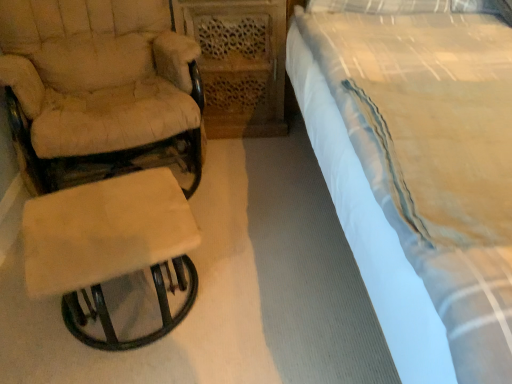
Question: Is beige fabric chair at left behind white cotton bed at right?

Choices:
 (A) yes
 (B) no

Answer: (A)

Question: Can you confirm if beige fabric chair at left is bigger than white cotton bed at right?

Choices:
 (A) yes
 (B) no

Answer: (B)

Question: Is beige fabric chair at left at the right side of white cotton bed at right?

Choices:
 (A) yes
 (B) no

Answer: (B)

Question: From the image's perspective, does beige fabric chair at left appear lower than white cotton bed at right?

Choices:
 (A) no
 (B) yes

Answer: (A)

Question: Is beige fabric chair at left to the left of white cotton bed at right from the viewer's perspective?

Choices:
 (A) no
 (B) yes

Answer: (B)

Question: Based on their sizes in the image, would you say white cotton bed at right is bigger or smaller than beige fabric stool at left?

Choices:
 (A) big
 (B) small

Answer: (A)

Question: Is white cotton bed at right taller or shorter than beige fabric stool at left?

Choices:
 (A) tall
 (B) short

Answer: (A)

Question: Does point pyautogui.click(x=461, y=365) appear closer or farther from the camera than point pyautogui.click(x=181, y=226)?

Choices:
 (A) farther
 (B) closer

Answer: (B)

Question: From a real-world perspective, is white cotton bed at right above or below beige fabric stool at left?

Choices:
 (A) below
 (B) above

Answer: (B)

Question: In the image, is white cotton bed at right on the left side or the right side of beige fabric chair at left?

Choices:
 (A) right
 (B) left

Answer: (A)

Question: Considering their positions, is white cotton bed at right located in front of or behind beige fabric chair at left?

Choices:
 (A) behind
 (B) front

Answer: (B)

Question: Choose the correct answer: Is white cotton bed at right inside beige fabric chair at left or outside it?

Choices:
 (A) outside
 (B) inside

Answer: (A)

Question: Considering the positions of white cotton bed at right and beige fabric chair at left in the image, is white cotton bed at right wider or thinner than beige fabric chair at left?

Choices:
 (A) thin
 (B) wide

Answer: (B)

Question: Based on their sizes in the image, would you say beige fabric stool at left is bigger or smaller than white cotton bed at right?

Choices:
 (A) small
 (B) big

Answer: (A)

Question: From the image's perspective, is beige fabric stool at left above or below white cotton bed at right?

Choices:
 (A) above
 (B) below

Answer: (B)